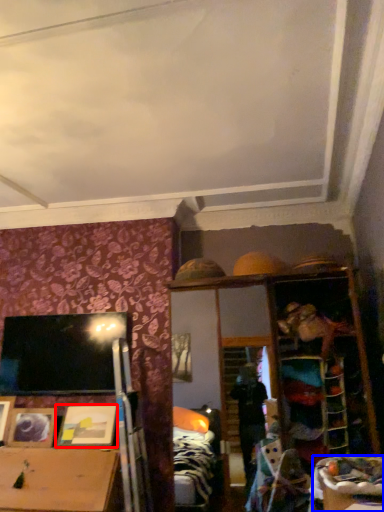
Question: Which object appears farthest to the camera in this image, picture frame (highlighted by a red box) or table (highlighted by a blue box)?

Choices:
 (A) picture frame
 (B) table

Answer: (A)